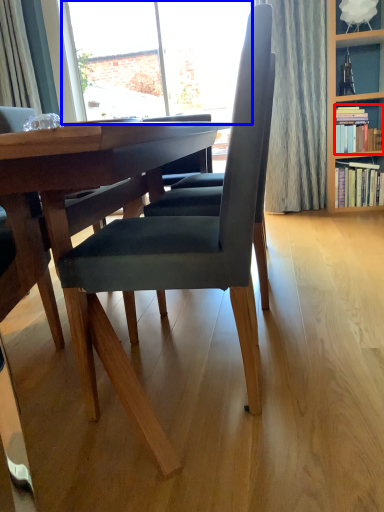
Question: Which object is closer to the camera taking this photo, book (highlighted by a red box) or window (highlighted by a blue box)?

Choices:
 (A) book
 (B) window

Answer: (A)